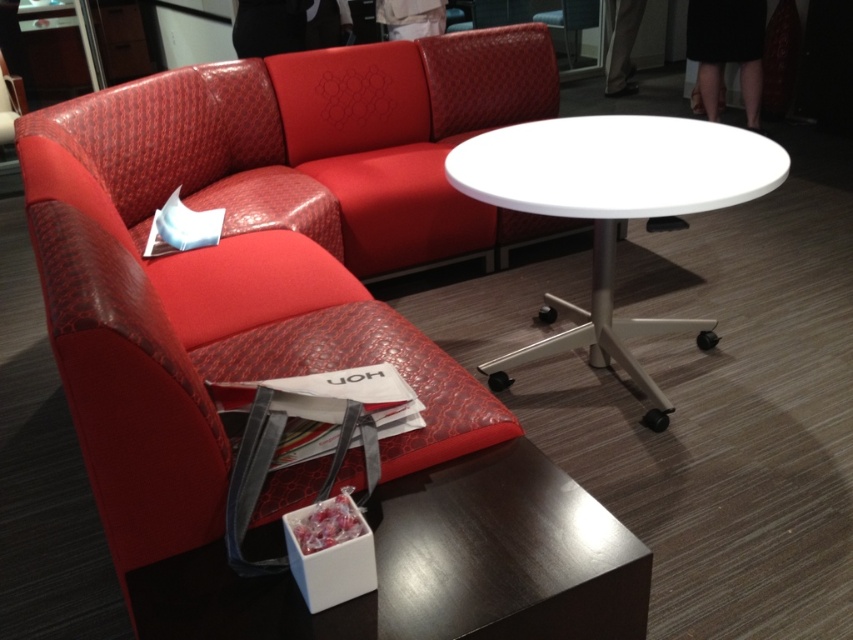
Question: Which point is closer to the camera?

Choices:
 (A) (643, 576)
 (B) (654, 400)
 (C) (285, 67)

Answer: (A)

Question: Does leather-like red couch at upper left have a smaller size compared to white glossy table at center?

Choices:
 (A) yes
 (B) no

Answer: (B)

Question: Which of the following is the farthest from the observer?

Choices:
 (A) leather-like red couch at upper left
 (B) white glossy table at center
 (C) shiny dark wood side table at lower center

Answer: (B)

Question: Is leather-like red couch at upper left closer to the viewer compared to shiny dark wood side table at lower center?

Choices:
 (A) no
 (B) yes

Answer: (B)

Question: Which object is the farthest from the leather-like red couch at upper left?

Choices:
 (A) white glossy table at center
 (B) shiny dark wood side table at lower center

Answer: (A)

Question: Is shiny dark wood side table at lower center wider than white glossy table at center?

Choices:
 (A) yes
 (B) no

Answer: (B)